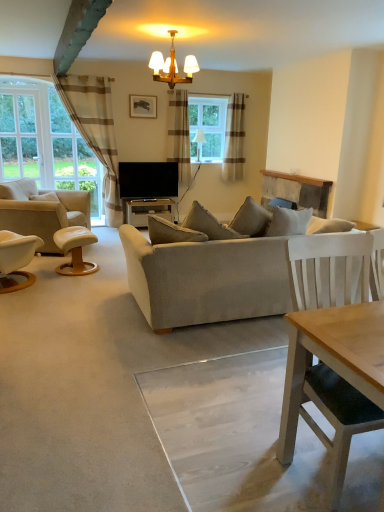
Question: Considering their positions, is black glossy desk at center located in front of or behind brown striped curtain at left, which is the third curtain in right-to-left order?

Choices:
 (A) front
 (B) behind

Answer: (B)

Question: Do you think black glossy desk at center is within brown striped curtain at left, which is the third curtain in right-to-left order, or outside of it?

Choices:
 (A) outside
 (B) inside

Answer: (A)

Question: Which object is positioned farthest from the light beige fabric couch at center?

Choices:
 (A) white leather stool at left
 (B) matte wooden chandelier at upper center, the first lamp when ordered from front to back
 (C) white leather ottoman at left
 (D) clear glass window at left
 (E) brown striped curtain at left, which is the 1th curtain in left-to-right order

Answer: (E)

Question: Estimate the real-world distances between objects in this image. Which object is farther from the flat screen tv at center?

Choices:
 (A) white fabric lampshade at upper center, the 2th lamp viewed from the front
 (B) matte black picture frame at upper center
 (C) light beige fabric couch at center
 (D) brown striped curtain at left, which is the third curtain in right-to-left order
 (E) plaid fabric curtain at center, marked as the 2th curtain in a right-to-left arrangement

Answer: (C)